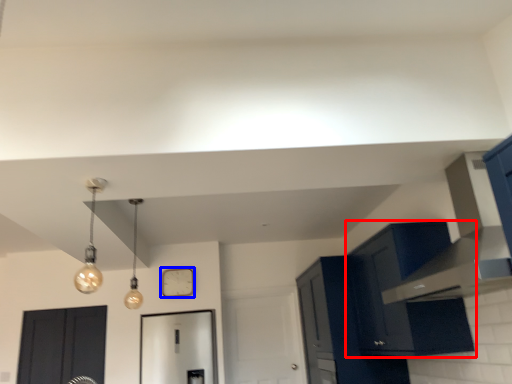
Question: Which object appears closest to the camera in this image, cabinetry (highlighted by a red box) or clock (highlighted by a blue box)?

Choices:
 (A) cabinetry
 (B) clock

Answer: (A)